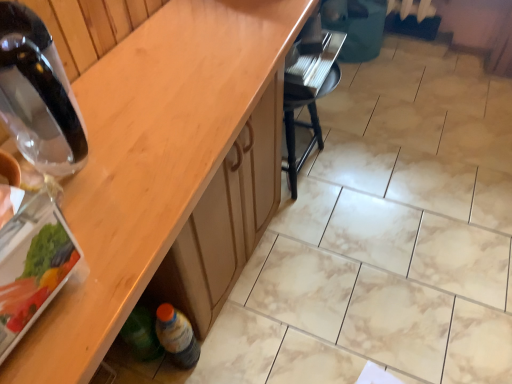
I want to click on unoccupied region to the right of transparent glass bottle at left, the first bottle viewed from the front, so [x=167, y=146].